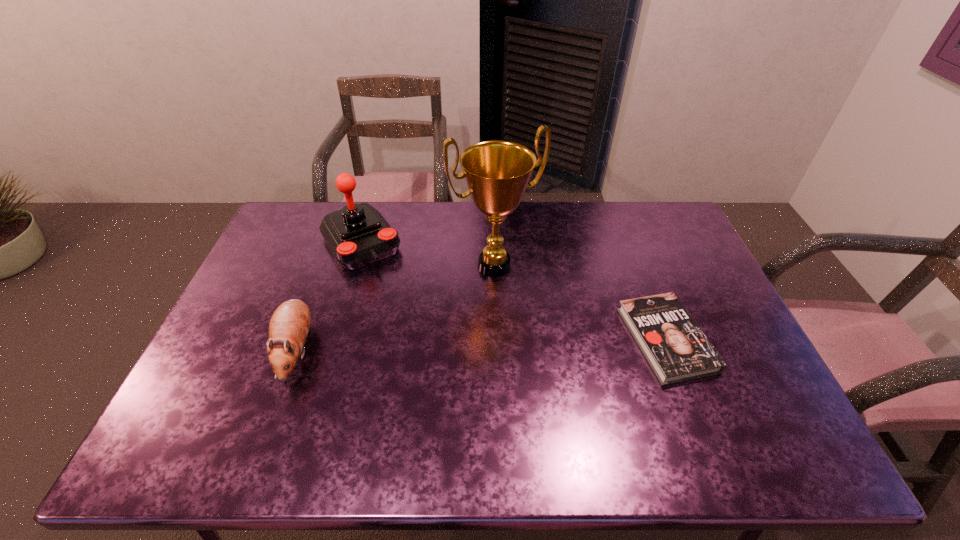
Locate an element on the screen. The image size is (960, 540). free space on the desktop that is between the hamster and the shortest object and is positioned on the base of the second tallest object is located at coordinates [429, 346].

Identify the location of free space on the desktop that is between the second shortest object and the shortest object and is positioned on the front view with handles of the tallest object. (531, 343).